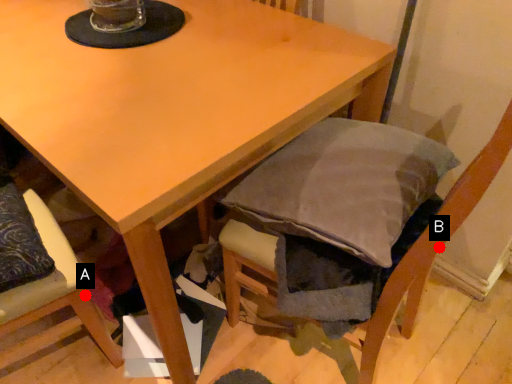
Question: Two points are circled on the image, labeled by A and B beside each circle. Among these points, which one is farthest from the camera?

Choices:
 (A) A is further
 (B) B is further

Answer: (A)